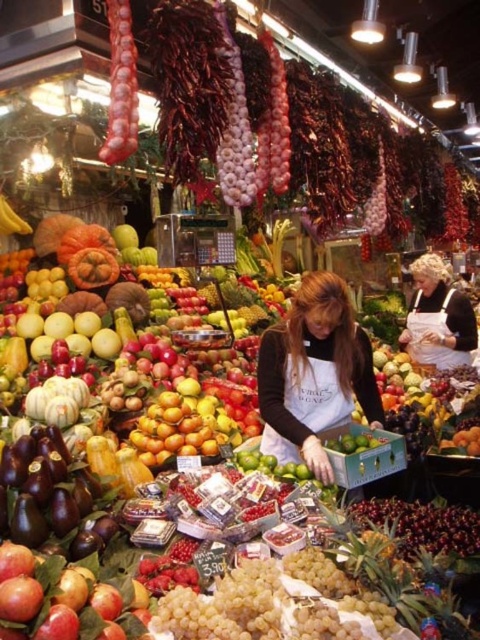
You are a customer at the market and want to pick up both the matte black apron at center and the black matte apron at center. However, you can only reach items within 2 meters. Can you reach both without moving?

The matte black apron at center and the black matte apron at center are 2.62 meters apart. Since the distance between them exceeds your 2 meter reach, you cannot reach both without moving.

You are a customer at the market and want to grab both the black matte apron at center and the shiny golden oranges at center. However, you can only reach items within 3 meters of each other. Can you reach both items without moving?

The black matte apron at center is 2.98 meters from the shiny golden oranges at center, which is within the 3 meter range, so yes, you can reach both items without moving.

You are a customer at the market and want to pick up the shiny golden oranges at center. However, there is a matte black apron at center in the way. Can you easily reach the oranges without moving the apron?

The matte black apron at center has a larger size compared to shiny golden oranges at center, so it might block access to the oranges. You may need to move the apron to reach them.